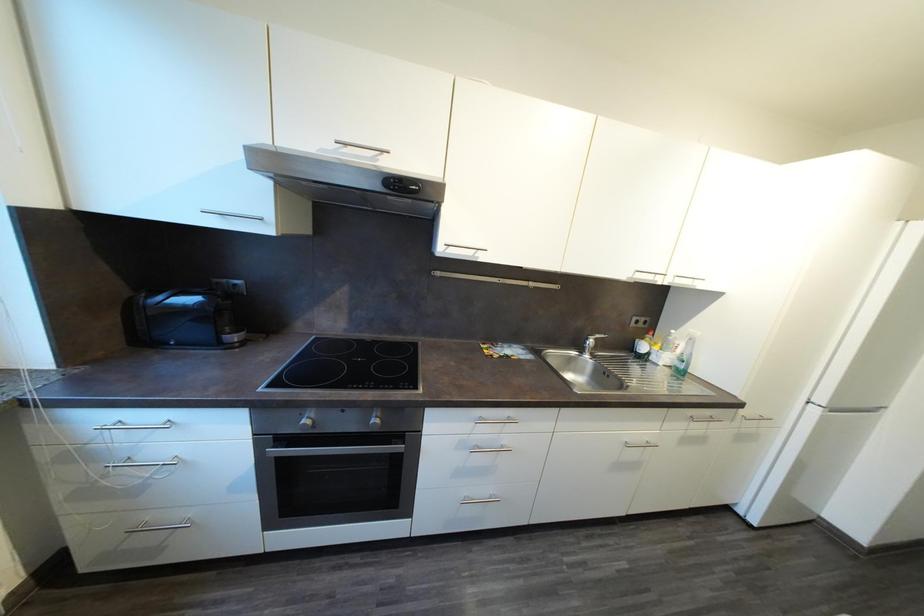
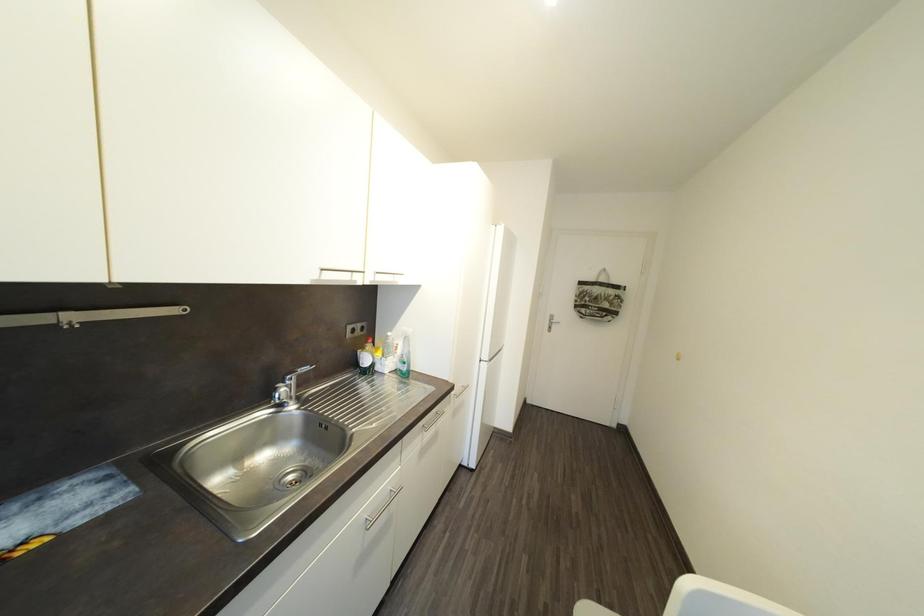
Question: The first image is from the beginning of the video and the second image is from the end. How did the camera likely rotate when shooting the video?

Choices:
 (A) Left
 (B) Right
 (C) Up
 (D) Down

Answer: (B)